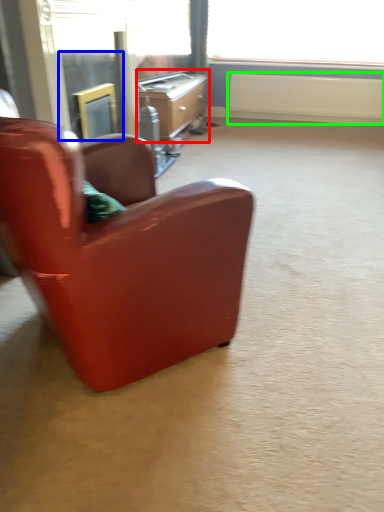
Question: Based on their relative distances, which object is nearer to desk (highlighted by a red box)? Choose from screen door (highlighted by a blue box) and radiator (highlighted by a green box).

Choices:
 (A) screen door
 (B) radiator

Answer: (A)